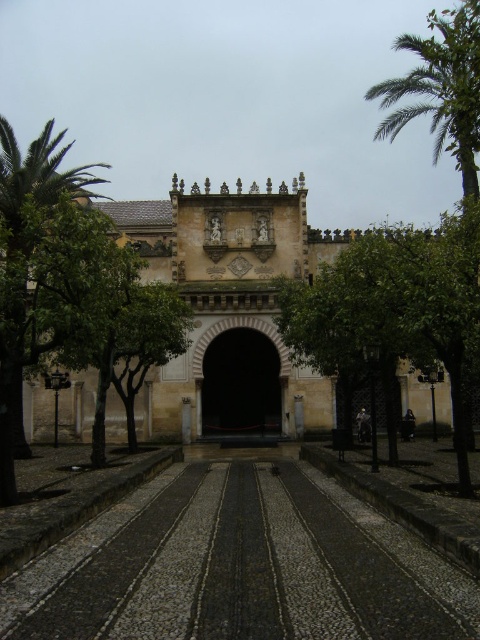
Question: Among these objects, which one is farthest from the camera?

Choices:
 (A) stone archway at center
 (B) green leafy tree at center
 (C) black textured pavement at center
 (D) dark stone archway at center

Answer: (D)

Question: Which of the following is the closest to the observer?

Choices:
 (A) click(x=425, y=321)
 (B) click(x=241, y=390)
 (C) click(x=458, y=147)

Answer: (A)

Question: From the image, what is the correct spatial relationship of green leafy tree at center in relation to dark stone archway at center?

Choices:
 (A) below
 (B) above

Answer: (B)

Question: Which object is the farthest from the stone archway at center?

Choices:
 (A) black textured pavement at center
 (B) green leafy tree at center
 (C) dark stone archway at center

Answer: (A)

Question: Is stone archway at center behind dark stone archway at center?

Choices:
 (A) yes
 (B) no

Answer: (B)

Question: Is green leafy tree at center below dark stone archway at center?

Choices:
 (A) yes
 (B) no

Answer: (B)